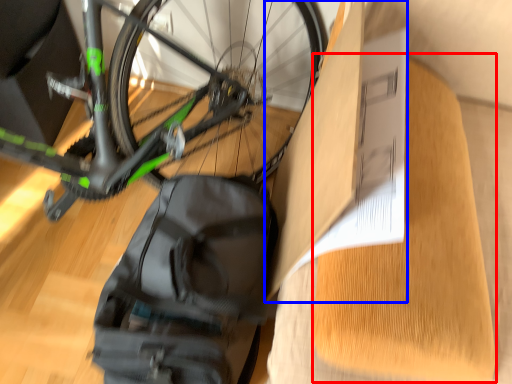
Question: Which of the following is the closest to the observer, cardboard (highlighted by a red box) or cardboard box (highlighted by a blue box)?

Choices:
 (A) cardboard
 (B) cardboard box

Answer: (A)